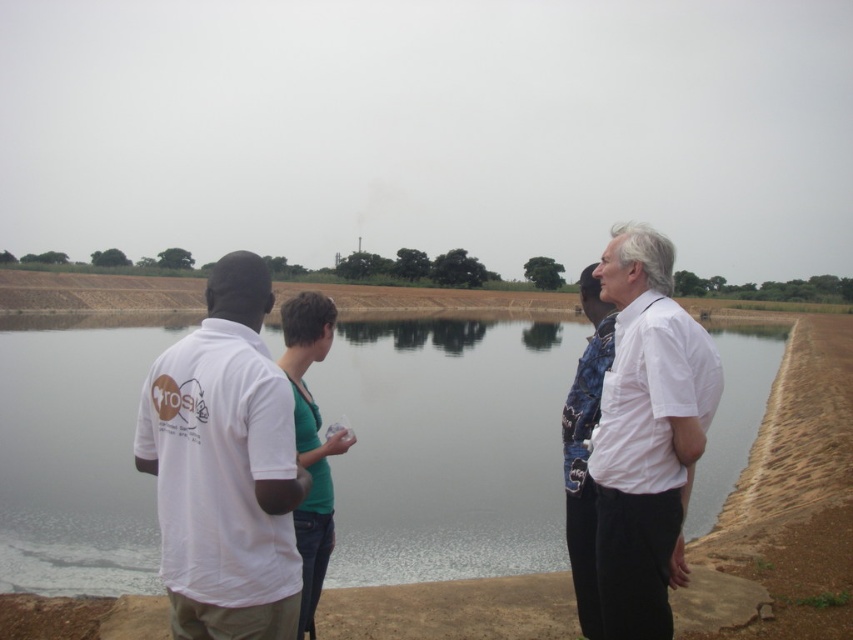
Question: Is white cotton shirt at left below white cotton shirt at right?

Choices:
 (A) no
 (B) yes

Answer: (A)

Question: Does white cotton shirt at left appear on the right side of white cotton shirt at right?

Choices:
 (A) no
 (B) yes

Answer: (A)

Question: Among these objects, which one is farthest from the camera?

Choices:
 (A) clear water at center
 (B) white cotton shirt at right

Answer: (A)

Question: Which object is closer to the camera taking this photo?

Choices:
 (A) clear water at center
 (B) white cotton shirt at right

Answer: (B)

Question: Is white cotton shirt at left smaller than white cotton shirt at right?

Choices:
 (A) no
 (B) yes

Answer: (A)

Question: Based on their relative distances, which object is farther from the white cotton shirt at right?

Choices:
 (A) clear water at center
 (B) white cotton shirt at left

Answer: (A)